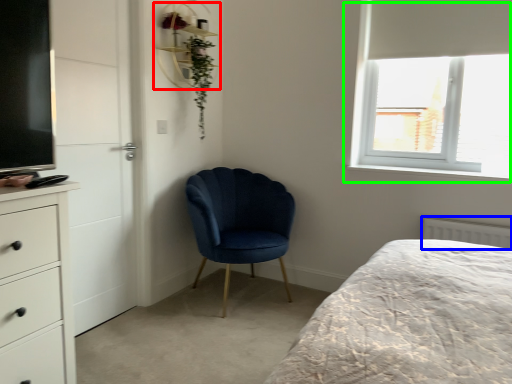
Question: Based on their relative distances, which object is farther from shelf (highlighted by a red box)? Choose from radiator (highlighted by a blue box) and window (highlighted by a green box).

Choices:
 (A) radiator
 (B) window

Answer: (A)